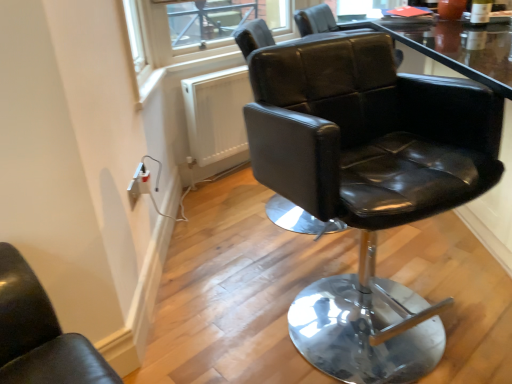
Question: Looking at their shapes, would you say transparent glass window screen at upper center is wider or thinner than black leather chair at center?

Choices:
 (A) wide
 (B) thin

Answer: (B)

Question: Based on their sizes in the image, would you say transparent glass window screen at upper center is bigger or smaller than black leather chair at center?

Choices:
 (A) big
 (B) small

Answer: (B)

Question: In terms of height, does transparent glass window screen at upper center look taller or shorter compared to black leather chair at center?

Choices:
 (A) short
 (B) tall

Answer: (A)

Question: From a real-world perspective, is black leather chair at center above or below transparent glass window screen at upper center?

Choices:
 (A) above
 (B) below

Answer: (B)

Question: From the image's perspective, is black leather chair at center above or below transparent glass window screen at upper center?

Choices:
 (A) below
 (B) above

Answer: (A)

Question: In terms of width, does black leather chair at center look wider or thinner when compared to transparent glass window screen at upper center?

Choices:
 (A) wide
 (B) thin

Answer: (A)

Question: Considering their positions, is black leather chair at center located in front of or behind transparent glass window screen at upper center?

Choices:
 (A) behind
 (B) front

Answer: (B)